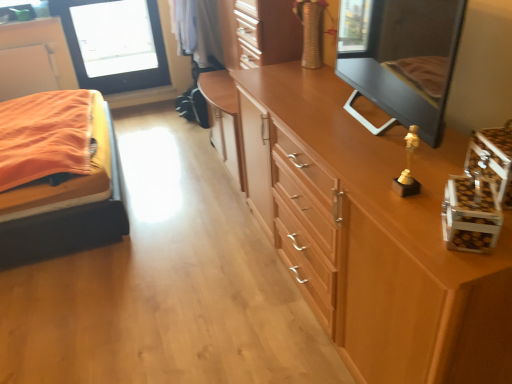
Question: From the image's perspective, is matte black mirror at upper right beneath wooden dresser at center?

Choices:
 (A) no
 (B) yes

Answer: (B)

Question: Is matte black mirror at upper right at the right side of wooden dresser at center?

Choices:
 (A) yes
 (B) no

Answer: (A)

Question: Does matte black mirror at upper right turn towards wooden dresser at center?

Choices:
 (A) yes
 (B) no

Answer: (B)

Question: From the image's perspective, is matte black mirror at upper right over wooden dresser at center?

Choices:
 (A) no
 (B) yes

Answer: (A)

Question: Can you confirm if matte black mirror at upper right is thinner than wooden dresser at center?

Choices:
 (A) yes
 (B) no

Answer: (A)

Question: Does matte black mirror at upper right touch wooden dresser at center?

Choices:
 (A) no
 (B) yes

Answer: (A)

Question: Can you confirm if wooden dresser at center is shorter than matte black mirror at upper right?

Choices:
 (A) yes
 (B) no

Answer: (B)

Question: From a real-world perspective, is wooden dresser at center on matte black mirror at upper right?

Choices:
 (A) yes
 (B) no

Answer: (B)

Question: Considering the relative sizes of wooden dresser at center and matte black mirror at upper right in the image provided, is wooden dresser at center thinner than matte black mirror at upper right?

Choices:
 (A) yes
 (B) no

Answer: (B)

Question: Is wooden dresser at center further to the viewer compared to matte black mirror at upper right?

Choices:
 (A) no
 (B) yes

Answer: (B)

Question: Can you confirm if wooden dresser at center is positioned to the left of matte black mirror at upper right?

Choices:
 (A) no
 (B) yes

Answer: (B)

Question: Can you confirm if wooden dresser at center is bigger than matte black mirror at upper right?

Choices:
 (A) yes
 (B) no

Answer: (A)

Question: From the image's perspective, would you say matte black mirror at upper right is positioned over orange fabric bed at left?

Choices:
 (A) no
 (B) yes

Answer: (B)